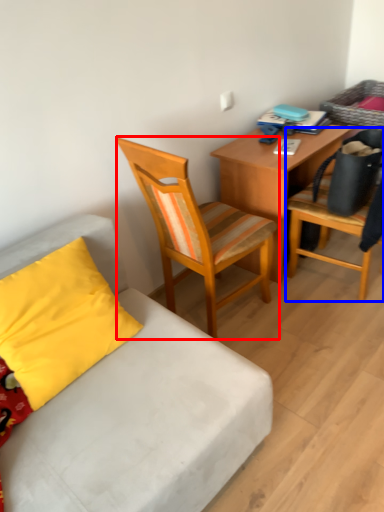
Question: Which point is further to the camera, chair (highlighted by a red box) or chair (highlighted by a blue box)?

Choices:
 (A) chair
 (B) chair

Answer: (B)